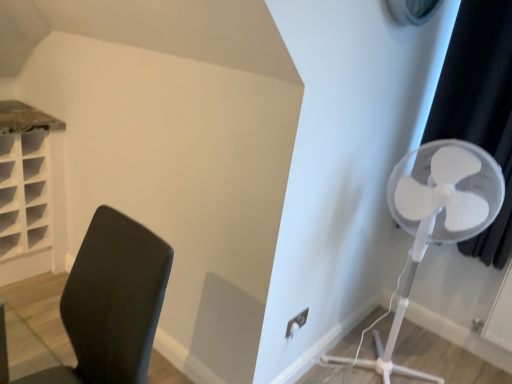
Question: Does black plastic chair at left have a lesser width compared to white plastic fan at right?

Choices:
 (A) yes
 (B) no

Answer: (A)

Question: Does black plastic chair at left lie in front of white plastic fan at right?

Choices:
 (A) no
 (B) yes

Answer: (B)

Question: From the image's perspective, is black plastic chair at left located beneath white plastic fan at right?

Choices:
 (A) no
 (B) yes

Answer: (B)

Question: Does black plastic chair at left appear on the left side of white plastic fan at right?

Choices:
 (A) yes
 (B) no

Answer: (A)

Question: Considering the relative sizes of black plastic chair at left and white plastic fan at right in the image provided, is black plastic chair at left taller than white plastic fan at right?

Choices:
 (A) yes
 (B) no

Answer: (B)

Question: Does point (444, 104) appear closer or farther from the camera than point (122, 258)?

Choices:
 (A) closer
 (B) farther

Answer: (B)

Question: Considering the positions of black fabric curtain at right and black plastic chair at left in the image, is black fabric curtain at right taller or shorter than black plastic chair at left?

Choices:
 (A) short
 (B) tall

Answer: (B)

Question: Is black fabric curtain at right in front of or behind black plastic chair at left in the image?

Choices:
 (A) front
 (B) behind

Answer: (B)

Question: From a real-world perspective, is black fabric curtain at right above or below black plastic chair at left?

Choices:
 (A) above
 (B) below

Answer: (A)

Question: Is white plastic fan at right situated inside black plastic chair at left or outside?

Choices:
 (A) inside
 (B) outside

Answer: (B)

Question: From a real-world perspective, is white plastic fan at right positioned above or below black plastic chair at left?

Choices:
 (A) below
 (B) above

Answer: (B)

Question: In terms of width, does white plastic fan at right look wider or thinner when compared to black plastic chair at left?

Choices:
 (A) thin
 (B) wide

Answer: (B)

Question: In terms of size, does white plastic fan at right appear bigger or smaller than black plastic chair at left?

Choices:
 (A) big
 (B) small

Answer: (A)

Question: Is black plastic chair at left spatially inside white plastic fan at right, or outside of it?

Choices:
 (A) inside
 (B) outside

Answer: (B)

Question: Considering the positions of black plastic chair at left and white plastic fan at right in the image, is black plastic chair at left wider or thinner than white plastic fan at right?

Choices:
 (A) wide
 (B) thin

Answer: (B)